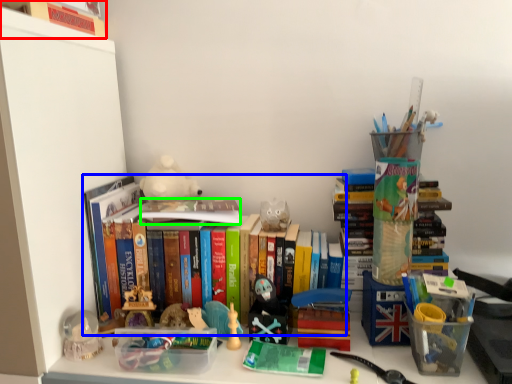
Question: Considering the real-world distances, which object is farthest from book (highlighted by a red box)? book (highlighted by a blue box) or book (highlighted by a green box)?

Choices:
 (A) book
 (B) book

Answer: (B)